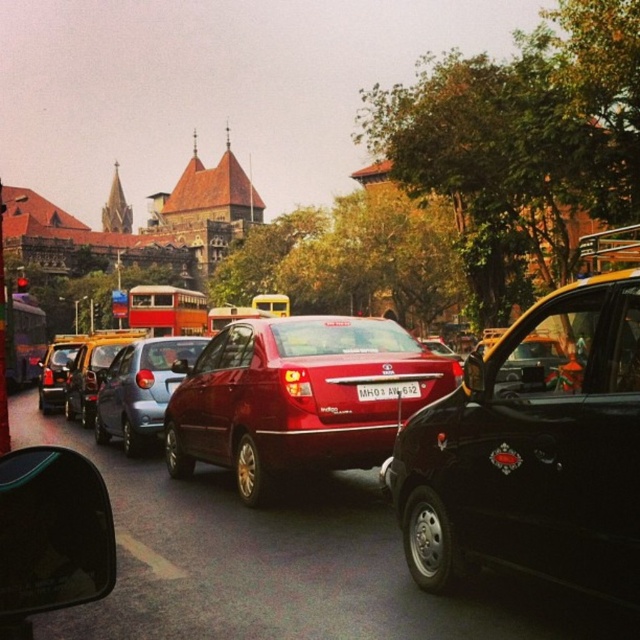
Question: Does shiny black taxi at right appear under metallic silver taxi at center?

Choices:
 (A) yes
 (B) no

Answer: (A)

Question: Among these objects, which one is farthest from the camera?

Choices:
 (A) matte black car at left
 (B) shiny black taxi at right

Answer: (A)

Question: Among these objects, which one is nearest to the camera?

Choices:
 (A) satin red sedan at center
 (B) shiny black taxi at right
 (C) matte black car at left
 (D) white plastic license plate at center

Answer: (B)

Question: Is red matte double-decker bus at center positioned before metallic silver taxi at center?

Choices:
 (A) yes
 (B) no

Answer: (B)

Question: Considering the real-world distances, which object is farthest from the metallic silver taxi at center?

Choices:
 (A) matte black car at left
 (B) satin red sedan at center
 (C) white plastic license plate at center
 (D) shiny black taxi at right

Answer: (D)

Question: Does shiny black taxi at right have a greater width compared to shiny red sedan at center?

Choices:
 (A) yes
 (B) no

Answer: (B)